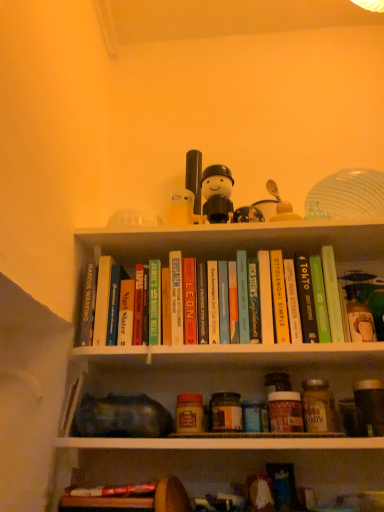
Identify the location of vacant area on the back side of hardcover book at center, the 10th paperback book positioned from the right. (119, 364).